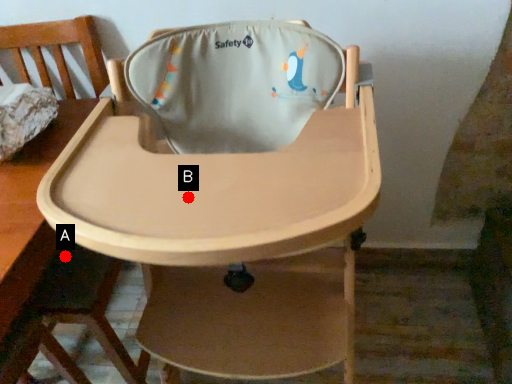
Question: Two points are circled on the image, labeled by A and B beside each circle. Which of the following is the closest to the observer?

Choices:
 (A) A is closer
 (B) B is closer

Answer: (B)